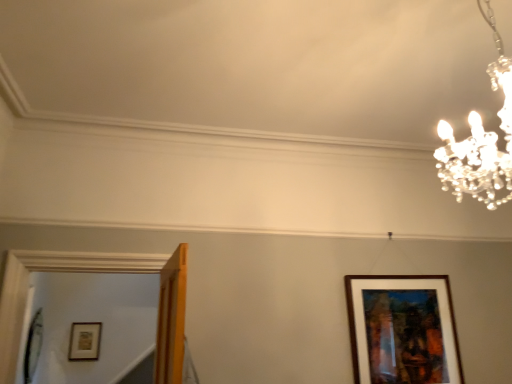
Where is `brown wooden picture frame at lower right, the 2th picture frame in the back-to-front sequence`? The image size is (512, 384). brown wooden picture frame at lower right, the 2th picture frame in the back-to-front sequence is located at coordinates (402, 330).

This screenshot has width=512, height=384. Describe the element at coordinates (481, 141) in the screenshot. I see `clear crystal chandelier at upper right` at that location.

This screenshot has height=384, width=512. Find the location of `brown wooden picture frame at lower right, which ranks as the second picture frame in bottom-to-top order`. brown wooden picture frame at lower right, which ranks as the second picture frame in bottom-to-top order is located at coordinates (402, 330).

Which of these two, clear crystal chandelier at upper right or brown wooden picture frame at lower right, which ranks as the second picture frame in bottom-to-top order, stands taller?

With more height is clear crystal chandelier at upper right.

From a real-world perspective, which is physically below, clear crystal chandelier at upper right or brown wooden picture frame at lower right, the 2th picture frame in the back-to-front sequence?

brown wooden picture frame at lower right, the 2th picture frame in the back-to-front sequence, is physically lower.

Is brown wooden picture frame at lower right, the 2th picture frame in the back-to-front sequence, a part of clear crystal chandelier at upper right?

No, brown wooden picture frame at lower right, the 2th picture frame in the back-to-front sequence, is not inside clear crystal chandelier at upper right.

Is clear crystal chandelier at upper right not near brown wooden picture frame at lower right, placed as the first picture frame when sorted from right to left?

Yes, clear crystal chandelier at upper right and brown wooden picture frame at lower right, placed as the first picture frame when sorted from right to left, are located far from each other.

Can you tell me how much clear crystal chandelier at upper right and wooden picture frame at lower left, placed as the 2th picture frame when sorted from top to bottom, differ in facing direction?

clear crystal chandelier at upper right and wooden picture frame at lower left, placed as the 2th picture frame when sorted from top to bottom, are facing 178 degrees away from each other.

Between clear crystal chandelier at upper right and wooden picture frame at lower left, the second picture frame from the front, which one appears on the left side from the viewer's perspective?

wooden picture frame at lower left, the second picture frame from the front, is more to the left.

Considering the sizes of objects clear crystal chandelier at upper right and wooden picture frame at lower left, arranged as the 1th picture frame when viewed from the back, in the image provided, who is shorter, clear crystal chandelier at upper right or wooden picture frame at lower left, arranged as the 1th picture frame when viewed from the back,?

wooden picture frame at lower left, arranged as the 1th picture frame when viewed from the back.

At what (x,y) coordinates should I click in order to perform the action: click on picture frame that is the 2nd one when counting downward from the clear crystal chandelier at upper right (from the image's perspective). Please return your answer as a coordinate pair (x, y). Looking at the image, I should click on (84, 341).

Can you confirm if wooden picture frame at lower left, arranged as the 1th picture frame when viewed from the back, is smaller than brown wooden picture frame at lower right, which ranks as the second picture frame in bottom-to-top order?

Correct, wooden picture frame at lower left, arranged as the 1th picture frame when viewed from the back, occupies less space than brown wooden picture frame at lower right, which ranks as the second picture frame in bottom-to-top order.

Which object is closer to the camera, wooden picture frame at lower left, the 1th picture frame positioned from the left, or brown wooden picture frame at lower right, which ranks as the second picture frame in bottom-to-top order?

brown wooden picture frame at lower right, which ranks as the second picture frame in bottom-to-top order, is more forward.

From the image's perspective, is wooden picture frame at lower left, marked as the first picture frame in a bottom-to-top arrangement, over brown wooden picture frame at lower right, positioned as the 2th picture frame in left-to-right order?

No, from the image's perspective, wooden picture frame at lower left, marked as the first picture frame in a bottom-to-top arrangement, is not over brown wooden picture frame at lower right, positioned as the 2th picture frame in left-to-right order.

Between brown wooden picture frame at lower right, positioned as the 2th picture frame in left-to-right order, and wooden picture frame at lower left, the second picture frame from the front, which one has more height?

With more height is brown wooden picture frame at lower right, positioned as the 2th picture frame in left-to-right order.

Is brown wooden picture frame at lower right, arranged as the 1th picture frame when viewed from the front, positioned before wooden picture frame at lower left, marked as the first picture frame in a bottom-to-top arrangement?

Yes, the depth of brown wooden picture frame at lower right, arranged as the 1th picture frame when viewed from the front, is less than that of wooden picture frame at lower left, marked as the first picture frame in a bottom-to-top arrangement.

From a real-world perspective, is brown wooden picture frame at lower right, positioned as the 2th picture frame in left-to-right order, physically above wooden picture frame at lower left, the second picture frame positioned from the right?

Correct, in the physical world, brown wooden picture frame at lower right, positioned as the 2th picture frame in left-to-right order, is higher than wooden picture frame at lower left, the second picture frame positioned from the right.

Considering the sizes of objects brown wooden picture frame at lower right, acting as the first picture frame starting from the top, and wooden picture frame at lower left, the second picture frame from the front, in the image provided, who is bigger, brown wooden picture frame at lower right, acting as the first picture frame starting from the top, or wooden picture frame at lower left, the second picture frame from the front,?

Answer: brown wooden picture frame at lower right, acting as the first picture frame starting from the top.

Based on the photo, from a real-world perspective, is wooden picture frame at lower left, placed as the 2th picture frame when sorted from top to bottom, above or below clear crystal chandelier at upper right?

In terms of real-world spatial position, wooden picture frame at lower left, placed as the 2th picture frame when sorted from top to bottom, is below clear crystal chandelier at upper right.

Considering their positions, is wooden picture frame at lower left, placed as the 2th picture frame when sorted from top to bottom, located in front of or behind clear crystal chandelier at upper right?

wooden picture frame at lower left, placed as the 2th picture frame when sorted from top to bottom, is positioned farther from the viewer than clear crystal chandelier at upper right.

Is wooden picture frame at lower left, marked as the first picture frame in a bottom-to-top arrangement, taller than clear crystal chandelier at upper right?

In fact, wooden picture frame at lower left, marked as the first picture frame in a bottom-to-top arrangement, may be shorter than clear crystal chandelier at upper right.

Is wooden picture frame at lower left, the second picture frame from the front, facing towards clear crystal chandelier at upper right?

No, wooden picture frame at lower left, the second picture frame from the front, is not turned towards clear crystal chandelier at upper right.

Measure the distance from brown wooden picture frame at lower right, positioned as the 2th picture frame in left-to-right order, to clear crystal chandelier at upper right.

A distance of 3.49 feet exists between brown wooden picture frame at lower right, positioned as the 2th picture frame in left-to-right order, and clear crystal chandelier at upper right.

Which object is wider, brown wooden picture frame at lower right, placed as the first picture frame when sorted from right to left, or clear crystal chandelier at upper right?

clear crystal chandelier at upper right is wider.

Is brown wooden picture frame at lower right, positioned as the 2th picture frame in left-to-right order, positioned beyond the bounds of clear crystal chandelier at upper right?

Absolutely, brown wooden picture frame at lower right, positioned as the 2th picture frame in left-to-right order, is external to clear crystal chandelier at upper right.

From the picture: From the image's perspective, is brown wooden picture frame at lower right, which ranks as the second picture frame in bottom-to-top order, positioned above or below clear crystal chandelier at upper right?

From the image's perspective, brown wooden picture frame at lower right, which ranks as the second picture frame in bottom-to-top order, appears below clear crystal chandelier at upper right.

The height and width of the screenshot is (384, 512). In order to click on picture frame that is the 1st object located behind the clear crystal chandelier at upper right in this screenshot , I will do `click(402, 330)`.

Identify the location of picture frame on the left side of clear crystal chandelier at upper right. (84, 341).

Estimate the real-world distances between objects in this image. Which object is closer to wooden picture frame at lower left, the second picture frame from the front, brown wooden picture frame at lower right, positioned as the 2th picture frame in left-to-right order, or clear crystal chandelier at upper right?

Based on the image, brown wooden picture frame at lower right, positioned as the 2th picture frame in left-to-right order, appears to be nearer to wooden picture frame at lower left, the second picture frame from the front.

Based on their spatial positions, is clear crystal chandelier at upper right or wooden picture frame at lower left, arranged as the 1th picture frame when viewed from the back, closer to brown wooden picture frame at lower right, acting as the first picture frame starting from the top?

clear crystal chandelier at upper right is closer to brown wooden picture frame at lower right, acting as the first picture frame starting from the top.

Which object lies further to the anchor point brown wooden picture frame at lower right, arranged as the 1th picture frame when viewed from the front, wooden picture frame at lower left, the 1th picture frame positioned from the left, or clear crystal chandelier at upper right?

wooden picture frame at lower left, the 1th picture frame positioned from the left.

Based on their spatial positions, is brown wooden picture frame at lower right, the 2th picture frame in the back-to-front sequence, or wooden picture frame at lower left, the second picture frame from the front, closer to clear crystal chandelier at upper right?

Based on the image, brown wooden picture frame at lower right, the 2th picture frame in the back-to-front sequence, appears to be nearer to clear crystal chandelier at upper right.

Consider the image. When comparing their distances from wooden picture frame at lower left, marked as the first picture frame in a bottom-to-top arrangement, does clear crystal chandelier at upper right or brown wooden picture frame at lower right, the 2th picture frame in the back-to-front sequence, seem closer?

Based on the image, brown wooden picture frame at lower right, the 2th picture frame in the back-to-front sequence, appears to be nearer to wooden picture frame at lower left, marked as the first picture frame in a bottom-to-top arrangement.

When comparing their distances from clear crystal chandelier at upper right, does wooden picture frame at lower left, the second picture frame from the front, or brown wooden picture frame at lower right, positioned as the 2th picture frame in left-to-right order, seem closer?

Among the two, brown wooden picture frame at lower right, positioned as the 2th picture frame in left-to-right order, is located nearer to clear crystal chandelier at upper right.

Find the location of a particular element. This screenshot has width=512, height=384. picture frame between clear crystal chandelier at upper right and wooden picture frame at lower left, the second picture frame from the front, in the front-back direction is located at coordinates (402, 330).